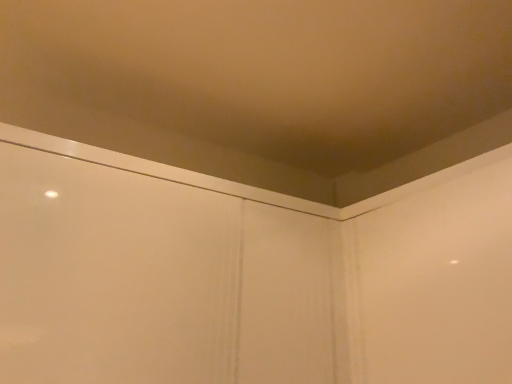
The height and width of the screenshot is (384, 512). Describe the element at coordinates (155, 280) in the screenshot. I see `white glossy screen door at upper center` at that location.

You are a GUI agent. You are given a task and a screenshot of the screen. Output one action in this format:
    pyautogui.click(x=<x>, y=<y>)
    Task: Click on the white glossy screen door at upper center
    
    Given the screenshot: What is the action you would take?
    pyautogui.click(x=155, y=280)

Measure the distance between point [180,294] and camera.

Point [180,294] is 99.20 centimeters away from camera.

Locate an element on the screen. Image resolution: width=512 pixels, height=384 pixels. white glossy screen door at upper center is located at coordinates (155, 280).